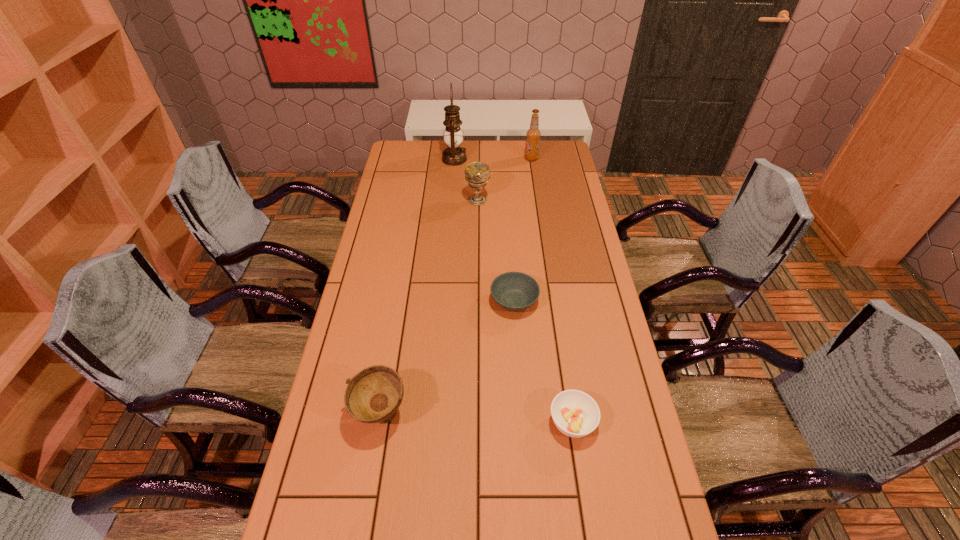
In the image, there is a desktop. Where is `vacant region at the far edge`? vacant region at the far edge is located at coordinates (438, 147).

You are a GUI agent. You are given a task and a screenshot of the screen. Output one action in this format:
    pyautogui.click(x=<x>, y=<y>)
    Task: Click on the vacant position at the left edge of the desktop
    
    Given the screenshot: What is the action you would take?
    pyautogui.click(x=360, y=429)

Identify the location of free space at the right edge. This screenshot has width=960, height=540. (619, 391).

Where is `blank space at the far left corner of the desktop`? blank space at the far left corner of the desktop is located at coordinates (413, 159).

The image size is (960, 540). I want to click on vacant space at the far right corner of the desktop, so click(540, 150).

You are a GUI agent. You are given a task and a screenshot of the screen. Output one action in this format:
    pyautogui.click(x=<x>, y=<y>)
    Task: Click on the free space between the third tallest object and the fourth farthest object
    The width and height of the screenshot is (960, 540).
    Given the screenshot: What is the action you would take?
    pyautogui.click(x=495, y=251)

The height and width of the screenshot is (540, 960). Identify the location of free area in between the fourth nearest object and the third nearest object. (495, 251).

Locate an element on the screen. This screenshot has width=960, height=540. vacant space that is in between the fifth shortest object and the farthest soup bowl is located at coordinates (523, 230).

In order to click on free spot between the beer bottle and the oil lamp in this screenshot , I will do `click(492, 159)`.

Locate an element on the screen. This screenshot has width=960, height=540. unoccupied area between the second tallest object and the fourth shortest object is located at coordinates (504, 179).